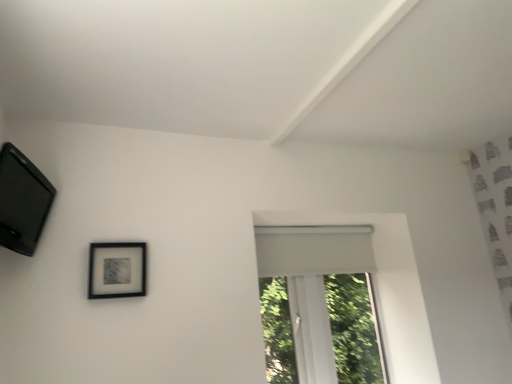
Question: From the image's perspective, is white matte window at center above matte black picture frame at upper left, positioned as the second picture frame in top-to-bottom order?

Choices:
 (A) no
 (B) yes

Answer: (A)

Question: Are white matte window at center and matte black picture frame at upper left, positioned as the second picture frame in top-to-bottom order, located far from each other?

Choices:
 (A) no
 (B) yes

Answer: (B)

Question: Is white matte window at center beside matte black picture frame at upper left, placed as the second picture frame when sorted from front to back?

Choices:
 (A) yes
 (B) no

Answer: (B)

Question: Is white matte window at center located outside matte black picture frame at upper left, positioned as the second picture frame in top-to-bottom order?

Choices:
 (A) no
 (B) yes

Answer: (B)

Question: Could you tell me if white matte window at center is turned towards matte black picture frame at upper left, the 1th picture frame ordered from the bottom?

Choices:
 (A) no
 (B) yes

Answer: (A)

Question: Is matte black picture frame at upper left, the first picture frame from the back, a part of white matte window at center?

Choices:
 (A) yes
 (B) no

Answer: (B)

Question: Is matte black picture frame at upper left, positioned as the second picture frame in top-to-bottom order, shorter than black matte picture frame at upper left, positioned as the 2th picture frame in right-to-left order?

Choices:
 (A) yes
 (B) no

Answer: (A)

Question: Can you confirm if matte black picture frame at upper left, the 1th picture frame ordered from the bottom, is bigger than black matte picture frame at upper left, the second picture frame in the back-to-front sequence?

Choices:
 (A) no
 (B) yes

Answer: (A)

Question: Does matte black picture frame at upper left, the first picture frame from the right, have a smaller size compared to black matte picture frame at upper left, positioned as the 2th picture frame in right-to-left order?

Choices:
 (A) no
 (B) yes

Answer: (B)

Question: Does matte black picture frame at upper left, placed as the second picture frame when sorted from front to back, appear on the left side of black matte picture frame at upper left, the 1th picture frame positioned from the left?

Choices:
 (A) yes
 (B) no

Answer: (B)

Question: Does matte black picture frame at upper left, the 1th picture frame ordered from the bottom, appear on the right side of black matte picture frame at upper left, positioned as the 2th picture frame in right-to-left order?

Choices:
 (A) no
 (B) yes

Answer: (B)

Question: From a real-world perspective, is matte black picture frame at upper left, the second picture frame viewed from the left, over black matte picture frame at upper left, arranged as the 1th picture frame when viewed from the top?

Choices:
 (A) yes
 (B) no

Answer: (B)

Question: Is black matte picture frame at upper left, the second picture frame in the back-to-front sequence, in front of white matte window at center?

Choices:
 (A) no
 (B) yes

Answer: (B)